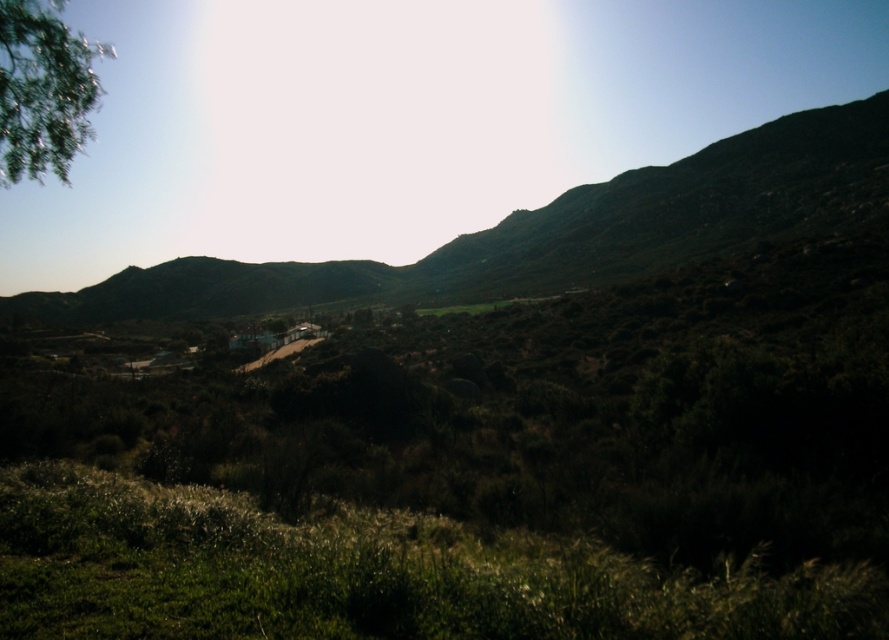
Question: Which of the following is the closest to the observer?

Choices:
 (A) (66, 179)
 (B) (614, 193)

Answer: (B)

Question: Which point is closer to the camera?

Choices:
 (A) (1, 81)
 (B) (131, 300)

Answer: (A)

Question: Does green grassy hill at center have a lesser width compared to green leafy tree at upper left?

Choices:
 (A) yes
 (B) no

Answer: (B)

Question: Is green grassy hill at center positioned at the back of green leafy tree at upper left?

Choices:
 (A) yes
 (B) no

Answer: (A)

Question: Which point appears farthest from the camera in this image?

Choices:
 (A) (47, 157)
 (B) (805, 196)

Answer: (B)

Question: From the image, what is the correct spatial relationship of green grassy hill at center in relation to green leafy tree at upper left?

Choices:
 (A) above
 (B) below

Answer: (A)